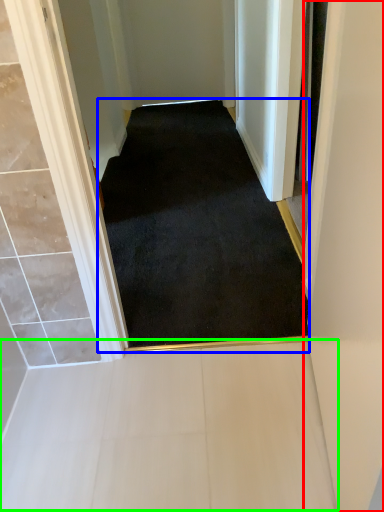
Question: Based on their relative distances, which object is farther from door (highlighted by a red box)? Choose from doormat (highlighted by a blue box) and path (highlighted by a green box).

Choices:
 (A) doormat
 (B) path

Answer: (A)